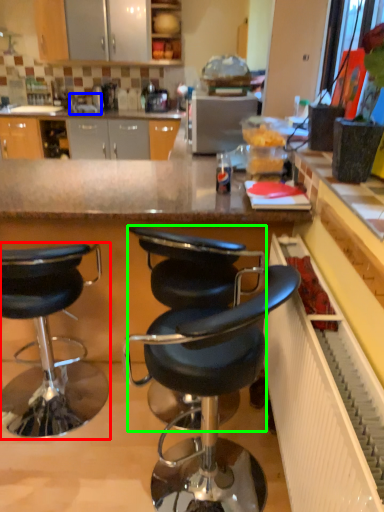
Question: Which object is the closest to the chair (highlighted by a red box)? Choose among these: sink (highlighted by a blue box) or chair (highlighted by a green box).

Choices:
 (A) sink
 (B) chair

Answer: (B)